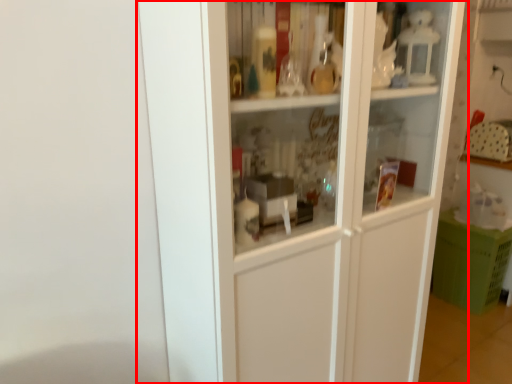
Question: From the image's perspective, considering the relative positions of cupboard (annotated by the red box) and cabinetry in the image provided, where is cupboard (annotated by the red box) located with respect to the staircase?

Choices:
 (A) above
 (B) below

Answer: (A)